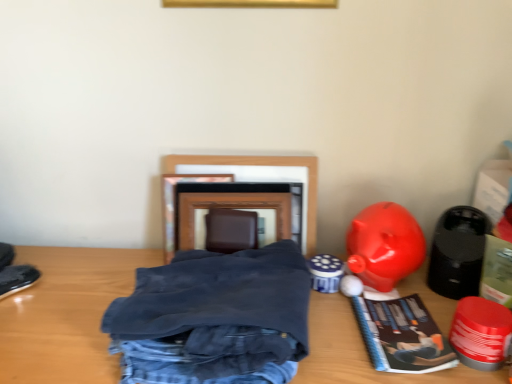
This screenshot has height=384, width=512. I want to click on free space between black suede shoe at left and dark blue cotton pants at center, so click(x=61, y=321).